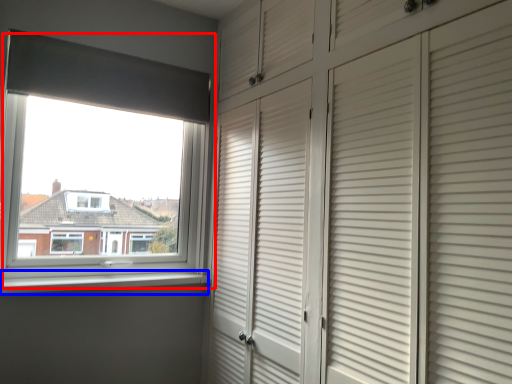
Question: Which object is further to the camera taking this photo, window (highlighted by a red box) or window sill (highlighted by a blue box)?

Choices:
 (A) window
 (B) window sill

Answer: (A)